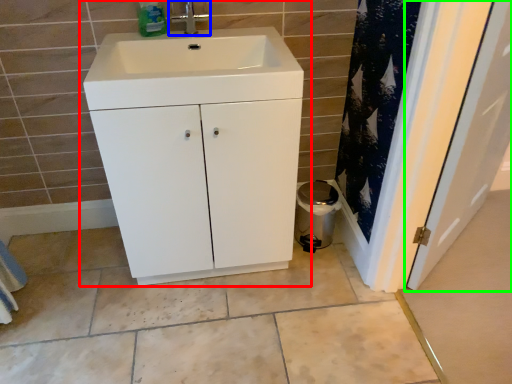
Question: Based on their relative distances, which object is farther from bathroom cabinet (highlighted by a red box)? Choose from tap (highlighted by a blue box) and door (highlighted by a green box).

Choices:
 (A) tap
 (B) door

Answer: (B)